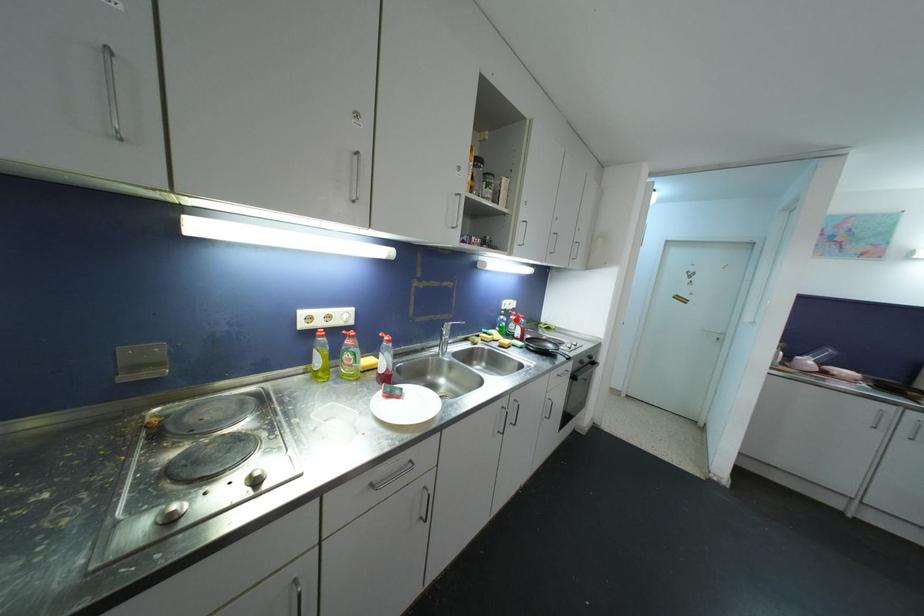
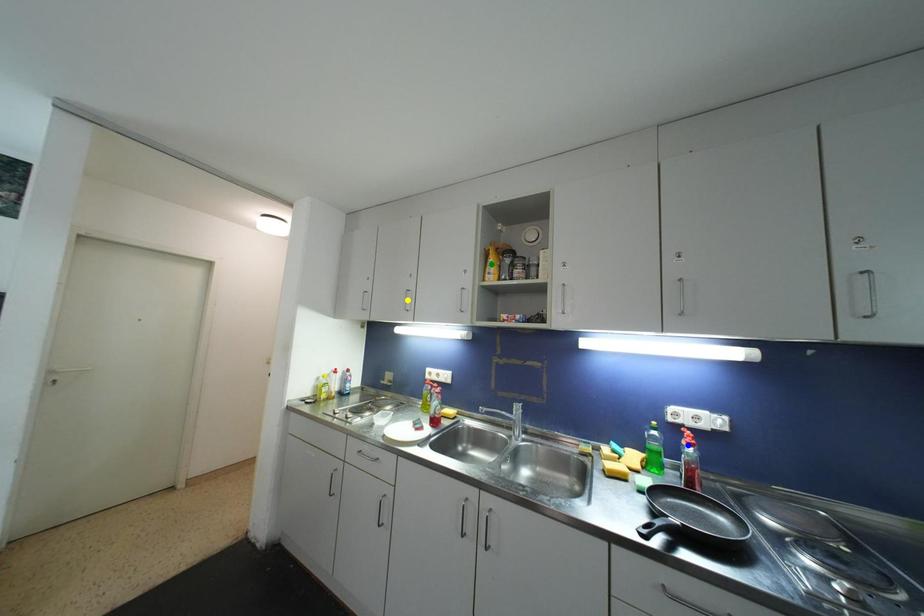
Question: I am providing you with two images of the same scene from different viewpoints. A red point is marked on the first image. You are given multiple points on the second image. Which point in image 2 represents the same 3d spot as the red point in image 1?

Choices:
 (A) yellow point
 (B) green point
 (C) blue point

Answer: (C)